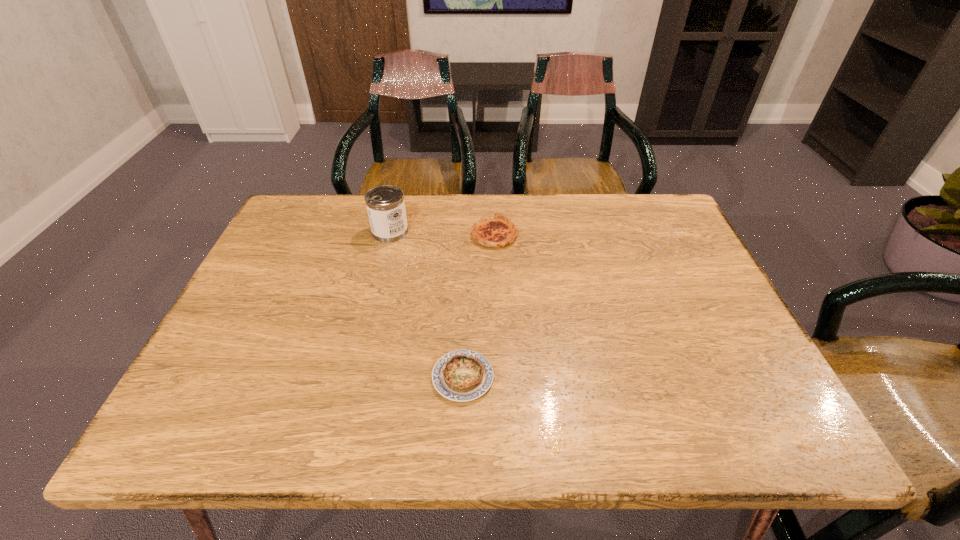
The image size is (960, 540). I want to click on free space between the taller quiche and the leftmost object, so click(x=443, y=233).

You are a GUI agent. You are given a task and a screenshot of the screen. Output one action in this format:
    pyautogui.click(x=<x>, y=<y>)
    Task: Click on the vacant area that lies between the tallest object and the shorter quiche
    
    Given the screenshot: What is the action you would take?
    pyautogui.click(x=426, y=304)

Where is `free space between the second tallest object and the can`? This screenshot has width=960, height=540. free space between the second tallest object and the can is located at coordinates (443, 233).

Locate an element on the screen. The width and height of the screenshot is (960, 540). empty space that is in between the nearer quiche and the second tallest object is located at coordinates (479, 306).

In order to click on free space that is in between the leftmost object and the taller quiche in this screenshot , I will do `click(443, 233)`.

I want to click on blank region between the nearest object and the tallest object, so click(426, 304).

This screenshot has height=540, width=960. Identify the location of free space between the second shortest object and the leftmost object. (443, 233).

Identify which object is the second nearest to the nearest object. Please provide its 2D coordinates. Your answer should be formatted as a tuple, i.e. [(x, y)], where the tuple contains the x and y coordinates of a point satisfying the conditions above.

[(385, 204)]

Identify which object is the closest to the shortest object. Please provide its 2D coordinates. Your answer should be formatted as a tuple, i.e. [(x, y)], where the tuple contains the x and y coordinates of a point satisfying the conditions above.

[(498, 231)]

In order to click on free location that satisfies the following two spatial constraints: 1. on the back side of the nearer quiche; 2. on the left side of the second tallest object in this screenshot , I will do 468,235.